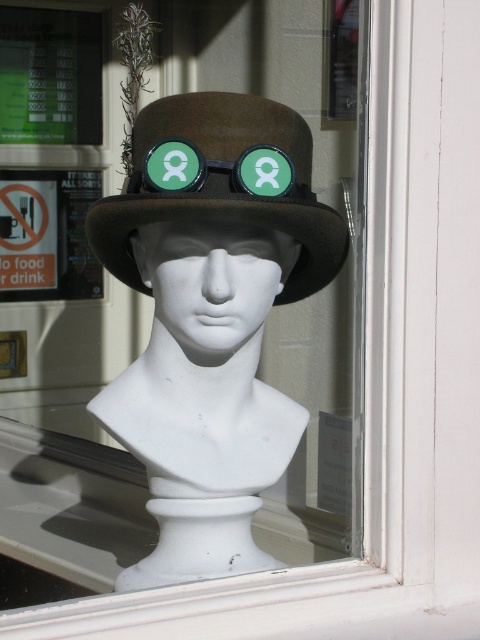
Is matte brown bust at center wider than brown felt hat at center?

No, matte brown bust at center is not wider than brown felt hat at center.

Does matte brown bust at center have a lesser width compared to brown felt hat at center?

Indeed, matte brown bust at center has a lesser width compared to brown felt hat at center.

Is point (211, 392) positioned behind point (322, 260)?

Yes.

Locate an element on the screen. matte brown bust at center is located at coordinates (211, 317).

Measure the distance between point (265, 397) and camera.

The distance of point (265, 397) from camera is 38.75 inches.

Between point (131, 248) and point (139, 234), which one is positioned behind?

Positioned behind is point (131, 248).

Identify the location of matte brown bust at center. click(211, 317).

Is point (168, 275) less distant than point (218, 164)?

No, (168, 275) is further to viewer.

Can you confirm if white matte bust at center is positioned below green matte goggles at center?

Correct, white matte bust at center is located below green matte goggles at center.

Is point (201, 330) more distant than point (245, 157)?

Yes, point (201, 330) is behind point (245, 157).

Locate an element on the screen. white matte bust at center is located at coordinates (212, 282).